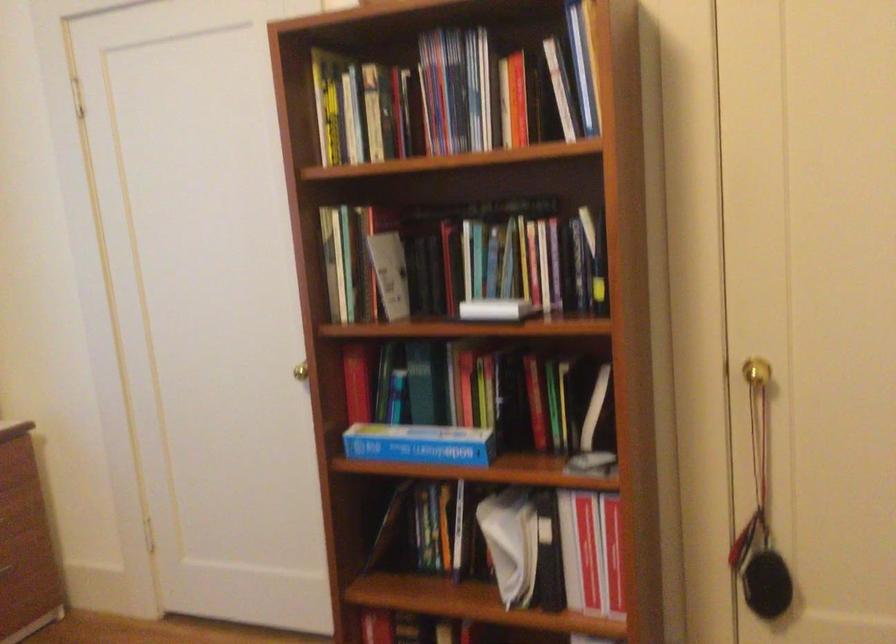
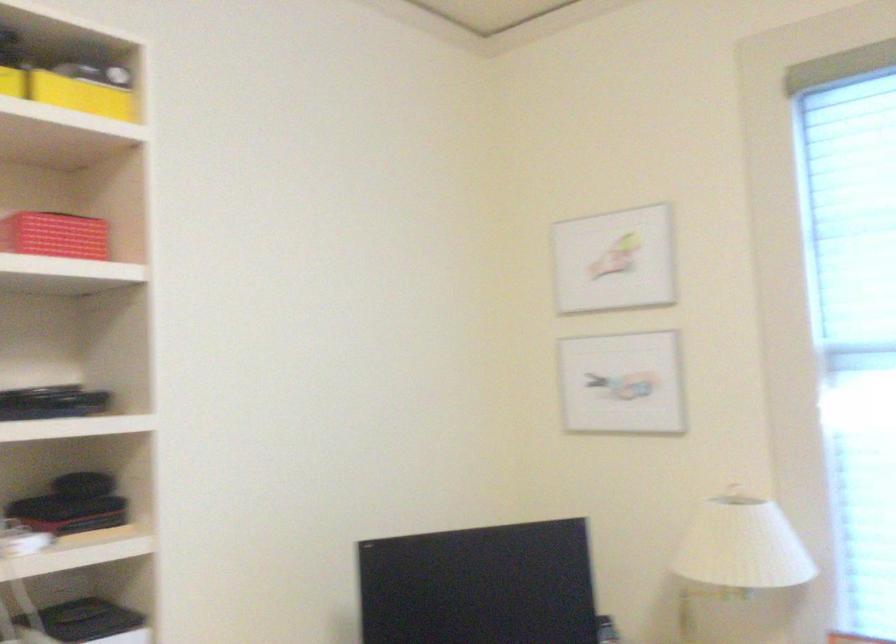
Question: Based on the continuous images, in which direction is the camera rotating? Reply with the corresponding letter.

Choices:
 (A) Left
 (B) Right
 (C) Up
 (D) Down

Answer: (A)